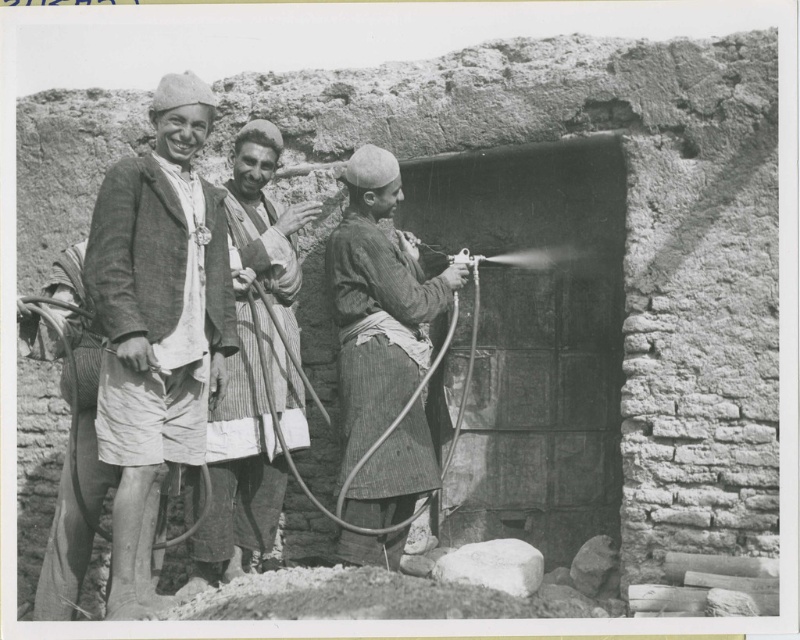
Which is behind, point (154, 468) or point (344, 538)?

The point (344, 538) is more distant.

From the picture: Who is lower down, matte white shirt at left or striped fabric spray gun at center?

matte white shirt at left is below.

Where is `matte white shirt at left`? The height and width of the screenshot is (640, 800). matte white shirt at left is located at coordinates point(158,320).

You are a GUI agent. You are given a task and a screenshot of the screen. Output one action in this format:
    pyautogui.click(x=<x>, y=<y>)
    Task: Click on the matte white shirt at left
    
    Given the screenshot: What is the action you would take?
    pyautogui.click(x=158, y=320)

Which is more to the left, striped fabric spray gun at center or striped fabric shirt at center?

Positioned to the left is striped fabric shirt at center.

Does striped fabric spray gun at center come behind striped fabric shirt at center?

That is False.

Who is more distant from viewer, (378, 305) or (240, 522)?

The point (240, 522) is behind.

The width and height of the screenshot is (800, 640). In order to click on striped fabric spray gun at center in this screenshot , I will do `click(378, 304)`.

Is matte white shirt at left thinner than striped fabric shirt at center?

Yes.

Image resolution: width=800 pixels, height=640 pixels. What are the coordinates of `matte white shirt at left` in the screenshot? It's located at (158, 320).

Who is more distant from viewer, (x=120, y=490) or (x=244, y=180)?

The point (x=244, y=180) is behind.

You are a GUI agent. You are given a task and a screenshot of the screen. Output one action in this format:
    pyautogui.click(x=<x>, y=<y>)
    Task: Click on the matte white shirt at left
    The width and height of the screenshot is (800, 640).
    Given the screenshot: What is the action you would take?
    pyautogui.click(x=158, y=320)